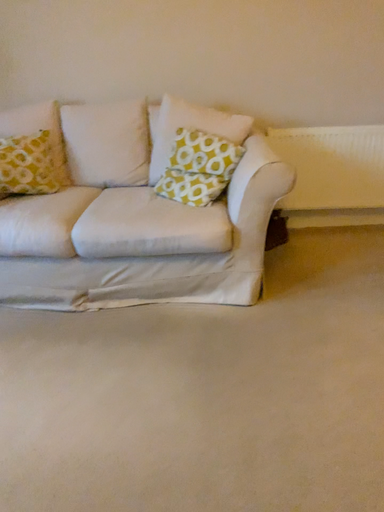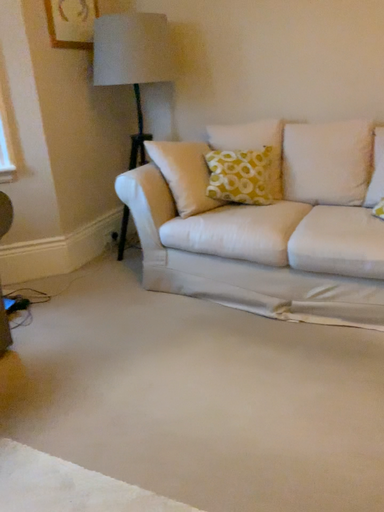
Question: How did the camera likely rotate when shooting the video?

Choices:
 (A) rotated left
 (B) rotated right

Answer: (A)